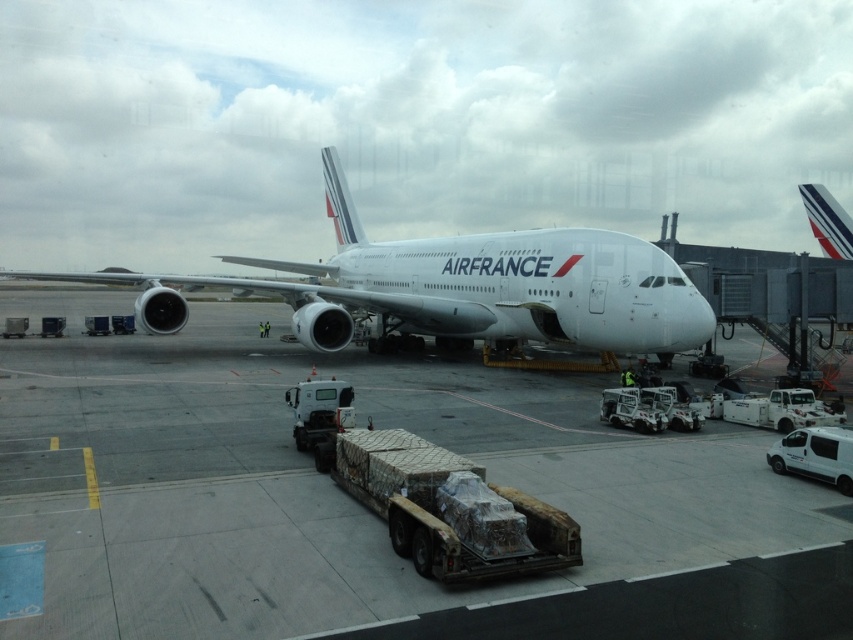
Does white concrete tarmac at center have a greater height compared to white metallic airplane at center?

Incorrect, white concrete tarmac at center's height is not larger of white metallic airplane at center's.

Where is `white concrete tarmac at center`? white concrete tarmac at center is located at coordinates (331, 483).

The height and width of the screenshot is (640, 853). What are the coordinates of `white concrete tarmac at center` in the screenshot? It's located at (331, 483).

Looking at this image, between white concrete tarmac at center and white glossy airplane at upper center, which one appears on the right side from the viewer's perspective?

white glossy airplane at upper center is more to the right.

Does white concrete tarmac at center appear on the right side of white glossy airplane at upper center?

In fact, white concrete tarmac at center is to the left of white glossy airplane at upper center.

Measure the distance between point (227, 637) and camera.

Point (227, 637) and camera are 5.32 meters apart from each other.

At what (x,y) coordinates should I click in order to perform the action: click on white concrete tarmac at center. Please return your answer as a coordinate pair (x, y). Image resolution: width=853 pixels, height=640 pixels. Looking at the image, I should click on (331, 483).

Can you confirm if white metallic airplane at center is bigger than white glossy airplane at upper center?

No.

Identify the location of white metallic airplane at center. (457, 288).